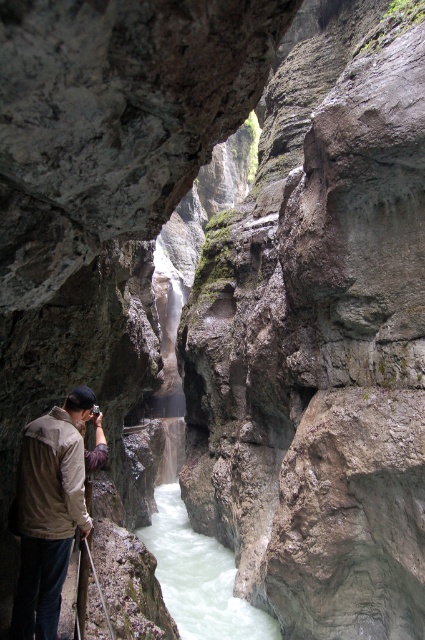
You are hiking in the canyon and want to place a marker at point (56, 512) and another at point (260, 636). Which marker will be closer to your current position?

The marker at point (56, 512) will be closer to your current position because it is closer to the viewer than point (260, 636).

You are hiking in the canyon and want to cross the river. You see the tan fabric jacket at lower left and the white frothy water at center. Which object is closer to your current position?

The tan fabric jacket at lower left is closer to your current position because it is positioned to the left of the white frothy water at center.